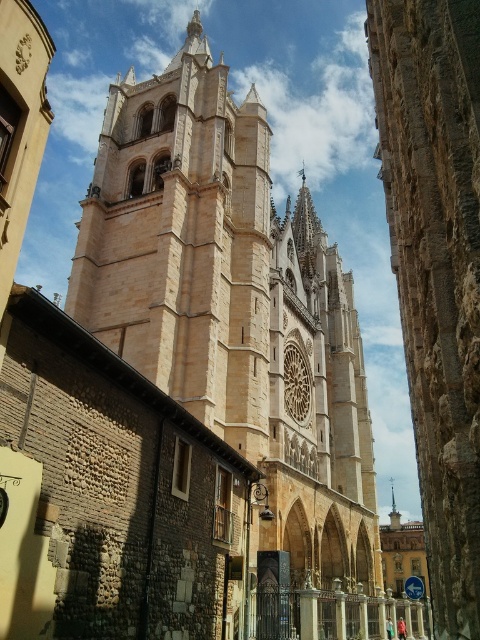
Is point (324, 488) closer to viewer compared to point (395, 522)?

Yes, point (324, 488) is closer to viewer.

Which is above, beige stone tower at center or smooth silver spire at center?

beige stone tower at center is above.

Is point (287, 513) closer to camera compared to point (392, 500)?

That is True.

Identify the location of beige stone tower at center. (232, 305).